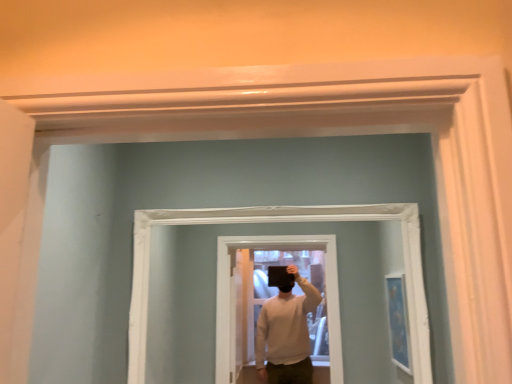
Locate an element on the screen. The height and width of the screenshot is (384, 512). white painted wood at center is located at coordinates (278, 222).

Image resolution: width=512 pixels, height=384 pixels. Describe the element at coordinates (278, 222) in the screenshot. I see `white painted wood at center` at that location.

The width and height of the screenshot is (512, 384). Find the location of `white painted wood at center`. white painted wood at center is located at coordinates (278, 222).